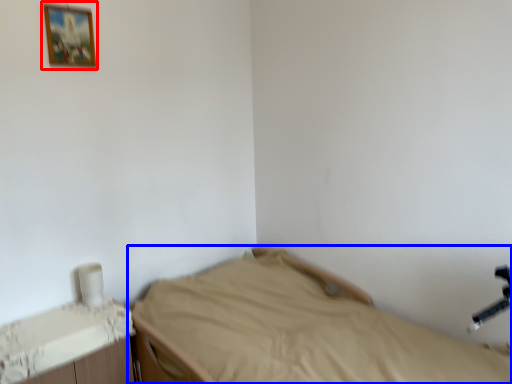
Question: Which of the following is the farthest to the observer, picture frame (highlighted by a red box) or bed (highlighted by a blue box)?

Choices:
 (A) picture frame
 (B) bed

Answer: (A)